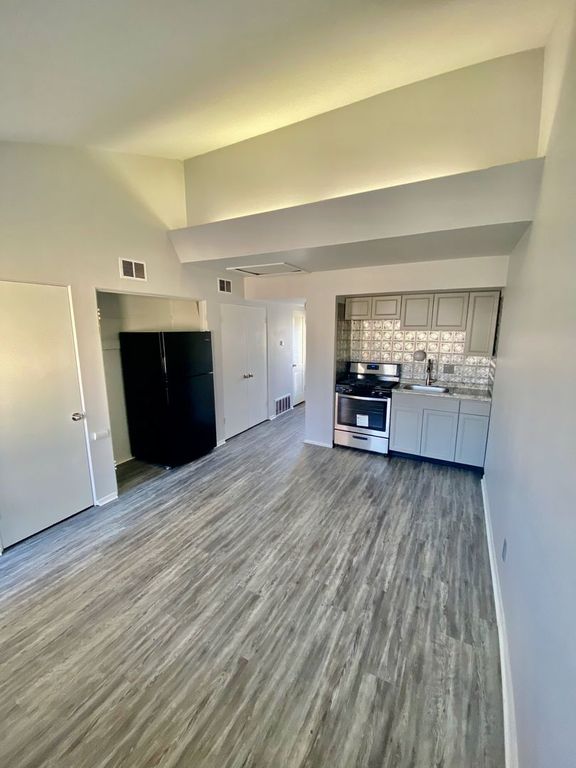
Locate an element on the screen. The height and width of the screenshot is (768, 576). outlet is located at coordinates (502, 547).